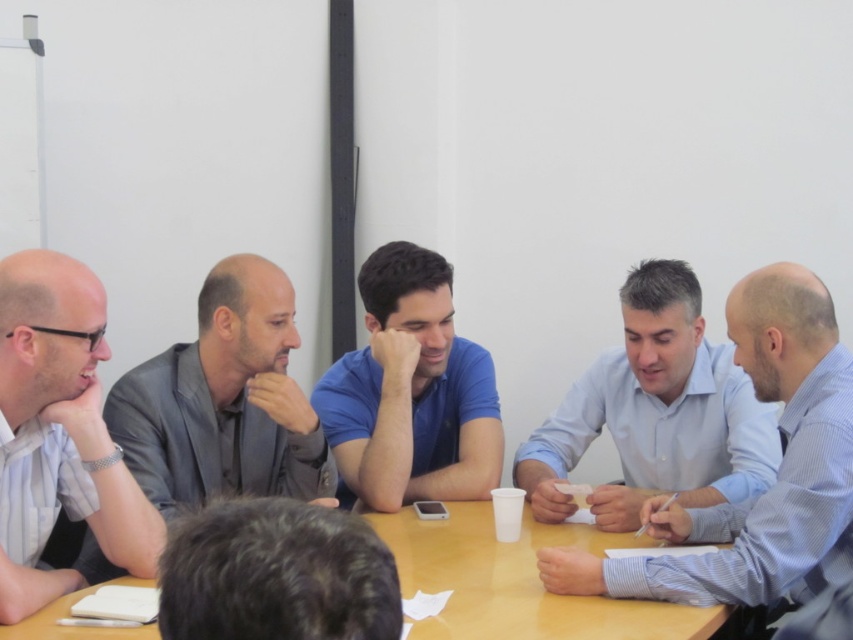
Which is behind, point (292, 340) or point (306, 637)?

The point (292, 340) is more distant.

Can you confirm if gray fabric shirt at left is positioned to the right of dark brown hair at center?

Incorrect, gray fabric shirt at left is not on the right side of dark brown hair at center.

At what (x,y) coordinates should I click in order to perform the action: click on gray fabric shirt at left. Please return your answer as a coordinate pair (x, y). Looking at the image, I should click on (224, 401).

Locate an element on the screen. The width and height of the screenshot is (853, 640). gray fabric shirt at left is located at coordinates (224, 401).

Does gray fabric shirt at left appear under blue cotton shirt at center?

Correct, gray fabric shirt at left is located below blue cotton shirt at center.

Measure the distance between point (320,474) and camera.

The distance of point (320,474) from camera is 2.04 meters.

Where is `gray fabric shirt at left`? gray fabric shirt at left is located at coordinates (224, 401).

Consider the image. Can you confirm if blue cotton shirt at center is shorter than dark brown hair at center?

No.

Who is more forward, (x=386, y=440) or (x=160, y=628)?

Point (x=160, y=628) is in front.

Is point (384, 349) farther from camera compared to point (363, 618)?

Yes, it is.

Locate an element on the screen. blue cotton shirt at center is located at coordinates pyautogui.click(x=410, y=392).